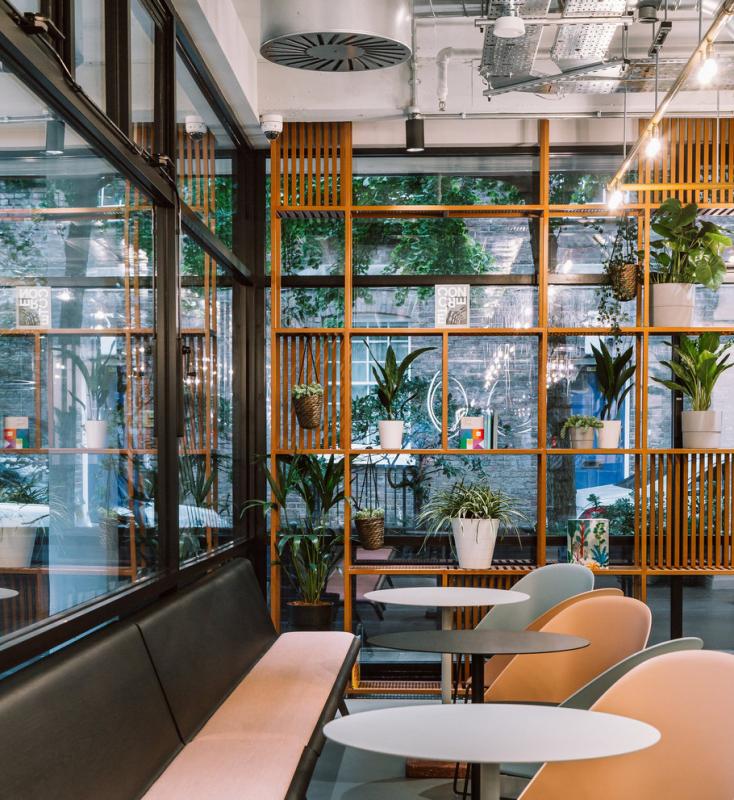
The width and height of the screenshot is (734, 800). Identify the location of window panes. [210, 140], [145, 101], [86, 54], [111, 296], [211, 326], [657, 364], [721, 382], [479, 252], [644, 654].